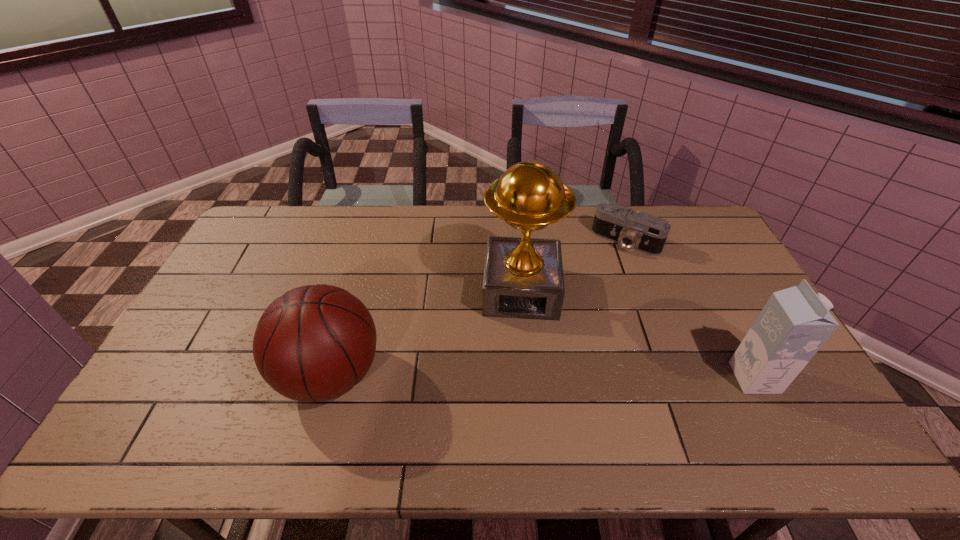
Image resolution: width=960 pixels, height=540 pixels. Identify the location of vacant region located 0.290m on the lens of the third object from left to right. (580, 307).

Find the location of `free space located 0.190m on the lens of the third object from left to right`. free space located 0.190m on the lens of the third object from left to right is located at coordinates (592, 287).

Where is `vacant region located on the lens of the third object from left to right`? Image resolution: width=960 pixels, height=540 pixels. vacant region located on the lens of the third object from left to right is located at coordinates (607, 264).

Find the location of a particular element. Image resolution: width=960 pixels, height=540 pixels. object that is positioned at the far edge is located at coordinates (630, 229).

I want to click on basketball that is at the near edge, so click(x=314, y=343).

In order to click on carton present at the near edge in this screenshot , I will do `click(794, 324)`.

Where is `object present at the right edge`? This screenshot has width=960, height=540. object present at the right edge is located at coordinates (794, 324).

This screenshot has width=960, height=540. I want to click on object present at the near right corner, so click(x=794, y=324).

This screenshot has width=960, height=540. In the image, there is a desktop. In order to click on free space at the far edge in this screenshot , I will do `click(580, 240)`.

I want to click on free location at the near edge, so click(x=638, y=387).